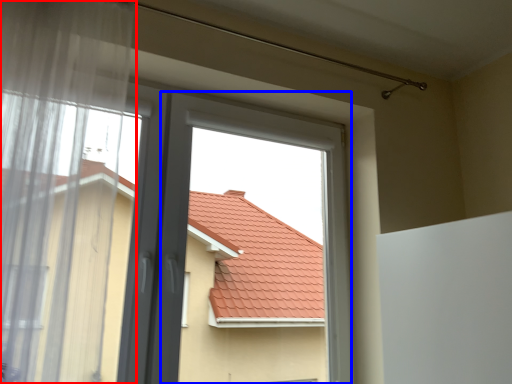
Question: Which of the following is the farthest to the observer, window (highlighted by a red box) or bay window (highlighted by a blue box)?

Choices:
 (A) window
 (B) bay window

Answer: (B)